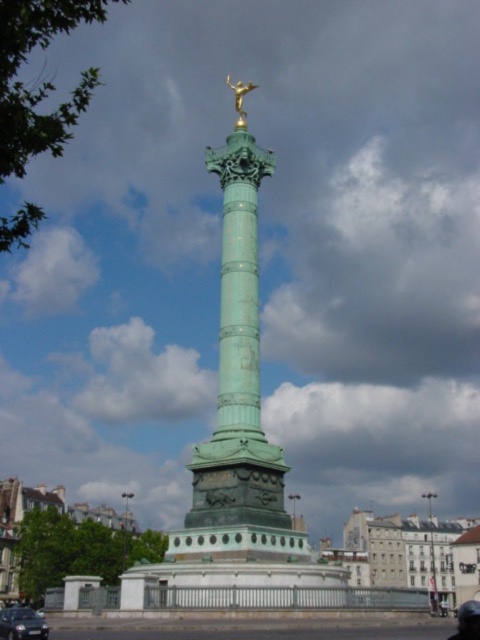
Is shiny black sedan at lower left to the left of goldmaterial/texturestatue at upper center from the viewer's perspective?

Indeed, shiny black sedan at lower left is positioned on the left side of goldmaterial/texturestatue at upper center.

Between point (13, 630) and point (236, 100), which one is positioned behind?

The point (236, 100) is more distant.

The image size is (480, 640). In order to click on shiny black sedan at lower left in this screenshot , I will do `click(22, 624)`.

Does green patina column at center lie in front of shiny black sedan at lower left?

No.

Which is behind, point (192, 595) or point (24, 628)?

Point (192, 595)

The image size is (480, 640). I want to click on green patina column at center, so coord(236,429).

Identify the location of green patina column at center. [x=236, y=429].

Who is taller, green patina column at center or goldmaterial/texturestatue at upper center?

goldmaterial/texturestatue at upper center

Which is in front, point (240, 211) or point (239, 81)?

Point (240, 211) is more forward.

What do you see at coordinates (236, 429) in the screenshot? I see `green patina column at center` at bounding box center [236, 429].

Locate an element on the screen. The height and width of the screenshot is (640, 480). green patina column at center is located at coordinates (236, 429).